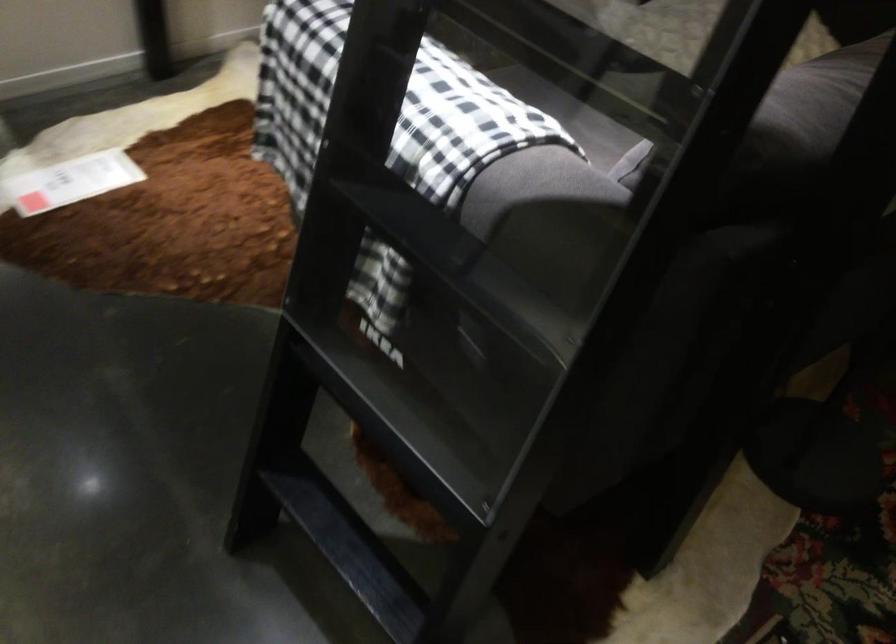
The height and width of the screenshot is (644, 896). What do you see at coordinates (650, 57) in the screenshot?
I see `the sofa sitting surface` at bounding box center [650, 57].